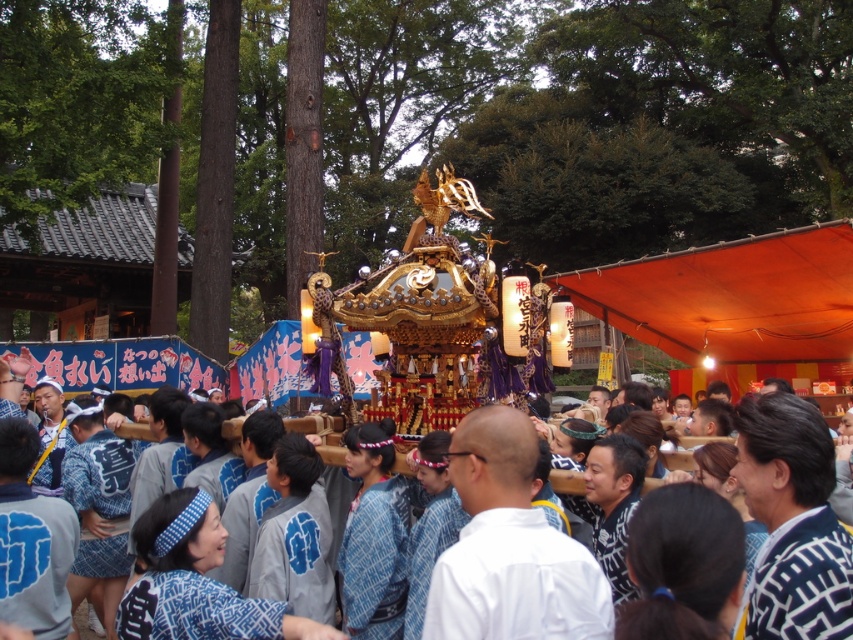
Can you confirm if knitted sweater at center is positioned to the left of blue patterned kimono at center?

No, knitted sweater at center is not to the left of blue patterned kimono at center.

Is knitted sweater at center taller than blue patterned kimono at center?

No.

Which is in front, point (782, 566) or point (759, 397)?

Positioned in front is point (782, 566).

This screenshot has width=853, height=640. Identify the location of knitted sweater at center. (804, 582).

Does white matte robe at center appear over knitted sweater at center?

Actually, white matte robe at center is below knitted sweater at center.

Can you confirm if white matte robe at center is positioned below knitted sweater at center?

Indeed, white matte robe at center is positioned under knitted sweater at center.

Is point (444, 568) positioned after point (784, 624)?

Yes, point (444, 568) is behind point (784, 624).

The height and width of the screenshot is (640, 853). In order to click on white matte robe at center in this screenshot , I will do `click(515, 582)`.

Is point (556, 573) positioned behind point (769, 474)?

No, (556, 573) is in front of (769, 474).

Consider the image. Is white matte robe at center taller than blue patterned kimono at center?

Incorrect, white matte robe at center's height is not larger of blue patterned kimono at center's.

Where is `white matte robe at center`? This screenshot has width=853, height=640. white matte robe at center is located at coordinates (515, 582).

Identify the location of white matte robe at center. (515, 582).